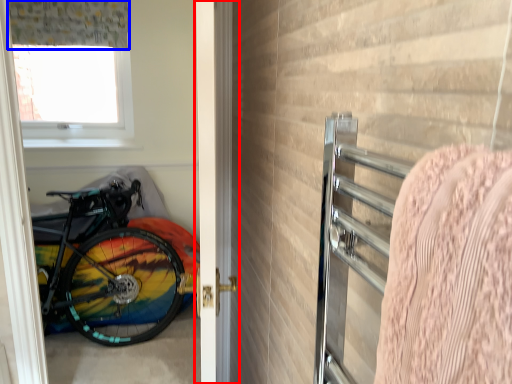
Question: Which of the following is the closest to the observer, door (highlighted by a red box) or curtain (highlighted by a blue box)?

Choices:
 (A) door
 (B) curtain

Answer: (A)